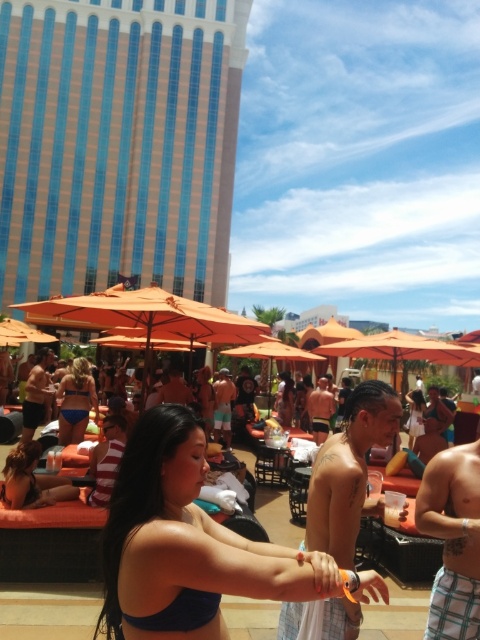
Question: Which point is farther to the camera?

Choices:
 (A) (331, 410)
 (B) (84, 433)

Answer: (A)

Question: Considering the relative positions of shiny metallic arm at center and matte black bikini top at center in the image provided, where is shiny metallic arm at center located with respect to matte black bikini top at center?

Choices:
 (A) right
 (B) left

Answer: (A)

Question: Which of the following is the closest to the observer?

Choices:
 (A) shiny metallic tank top at center
 (B) shiny metallic arm at center
 (C) orange fabric shorts at center
 (D) orange fabric umbrella at center

Answer: (B)

Question: Does orange fabric shorts at center appear under shiny metallic tank top at center?

Choices:
 (A) no
 (B) yes

Answer: (B)

Question: Which point is farther to the camera?

Choices:
 (A) (132, 323)
 (B) (405, 396)
 (C) (72, 426)

Answer: (B)

Question: Can you confirm if shiny metallic arm at center is smaller than matte black bikini at lower left?

Choices:
 (A) no
 (B) yes

Answer: (A)